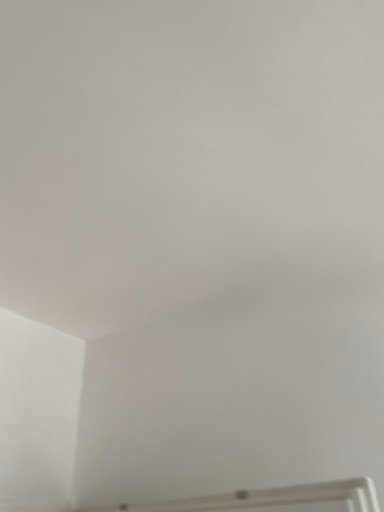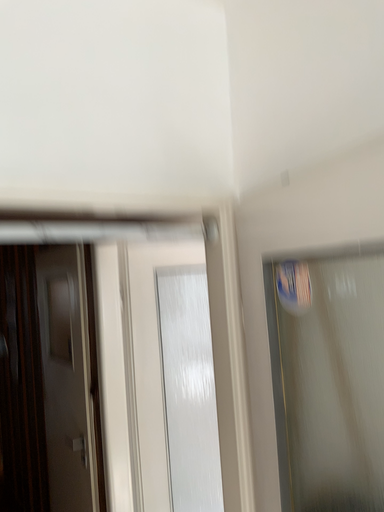
Question: How did the camera likely rotate when shooting the video?

Choices:
 (A) rotated right
 (B) rotated left

Answer: (B)